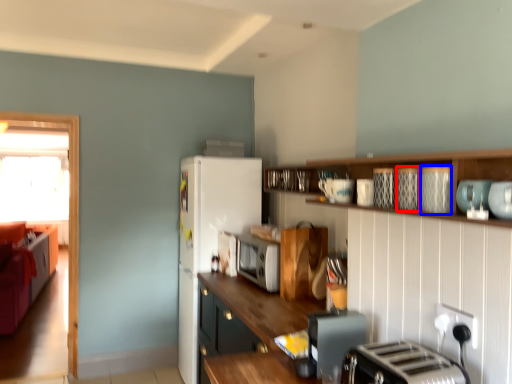
Question: Among these objects, which one is nearest to the camera, appliance (highlighted by a red box) or appliance (highlighted by a blue box)?

Choices:
 (A) appliance
 (B) appliance

Answer: (B)